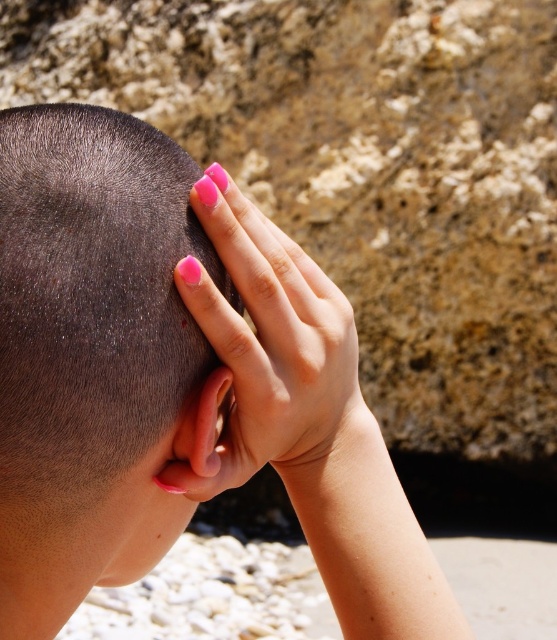
Consider the image. You are a photographer adjusting the focus on your camera. You need to ensure both the matte black hair at center and the pink polished nails at upper center are in focus. Given their heights, which object should you focus on first to capture both clearly?

The matte black hair at center is taller than the pink polished nails at upper center. To capture both in focus, you should focus on the matte black hair at center first as it is farther away, then adjust slightly for the closer nails.

You are a photographer adjusting your camera to focus on two points in the image. The first point is labeled as point (70, 369) and the second is point (307, 305). Since you can only focus on one point at a time, which point should you choose to ensure the other point remains in focus due to its position relative to the first?

Point (70, 369) is in front of point (307, 305). By focusing on the closer point, the depth of field may include the farther point in acceptable focus.